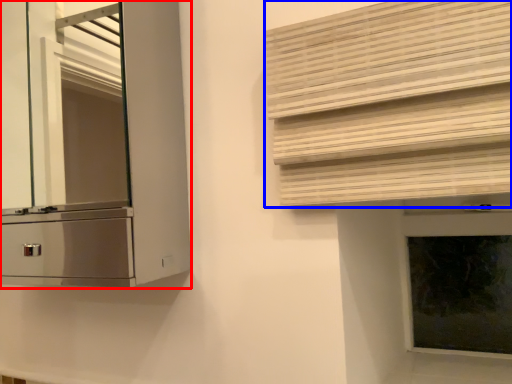
Question: Which of the following is the farthest to the observer, cabinetry (highlighted by a red box) or shutter (highlighted by a blue box)?

Choices:
 (A) cabinetry
 (B) shutter

Answer: (A)